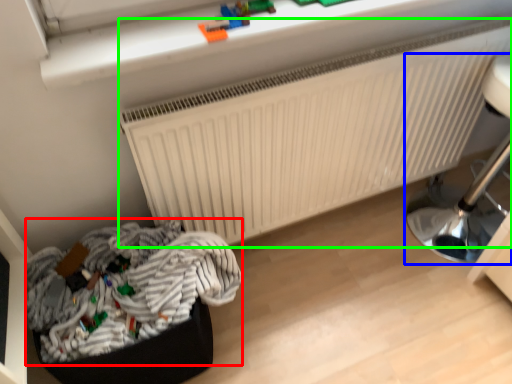
Question: Based on their relative distances, which object is farther from laundry (highlighted by a red box)? Choose from furniture (highlighted by a blue box) and radiator (highlighted by a green box).

Choices:
 (A) furniture
 (B) radiator

Answer: (A)